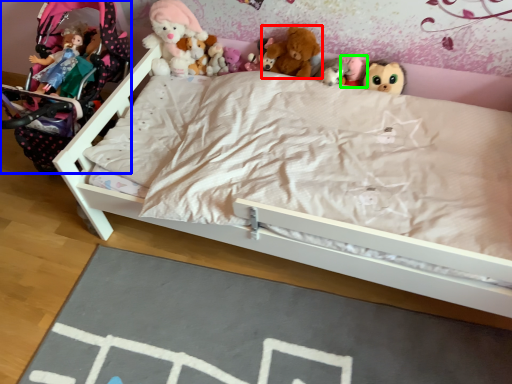
Question: Which is farther away from toy (highlighted by a red box)? baby carriage (highlighted by a blue box) or toy (highlighted by a green box)?

Choices:
 (A) baby carriage
 (B) toy

Answer: (A)